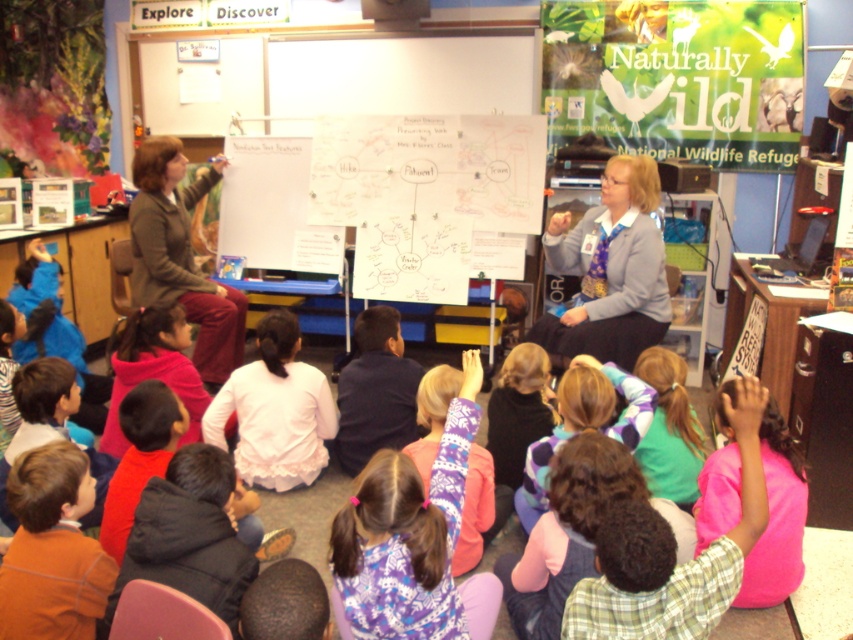
Does pink fleece sweater at lower right have a lesser height compared to orange cotton shirt at lower left?

No.

Which is more to the left, pink fleece sweater at lower right or orange cotton shirt at lower left?

From the viewer's perspective, orange cotton shirt at lower left appears more on the left side.

Who is more distant from viewer, (715, 598) or (55, 468)?

The point (55, 468) is more distant.

Locate an element on the screen. The image size is (853, 640). pink fleece sweater at lower right is located at coordinates (672, 554).

Which is more to the right, orange cotton shirt at lower left or matte green jacket at upper left?

orange cotton shirt at lower left

Between orange cotton shirt at lower left and matte green jacket at upper left, which one is positioned higher?

matte green jacket at upper left

Describe the element at coordinates (51, 548) in the screenshot. I see `orange cotton shirt at lower left` at that location.

Locate an element on the screen. Image resolution: width=853 pixels, height=640 pixels. orange cotton shirt at lower left is located at coordinates (51, 548).

Who is shorter, matte gray sweater at center or matte green jacket at upper left?

Standing shorter between the two is matte gray sweater at center.

Is matte gray sweater at center wider than matte green jacket at upper left?

Correct, the width of matte gray sweater at center exceeds that of matte green jacket at upper left.

Does point (656, 184) lie behind point (219, 316)?

No, (656, 184) is in front of (219, 316).

The width and height of the screenshot is (853, 640). In order to click on matte gray sweater at center in this screenshot , I will do point(610,269).